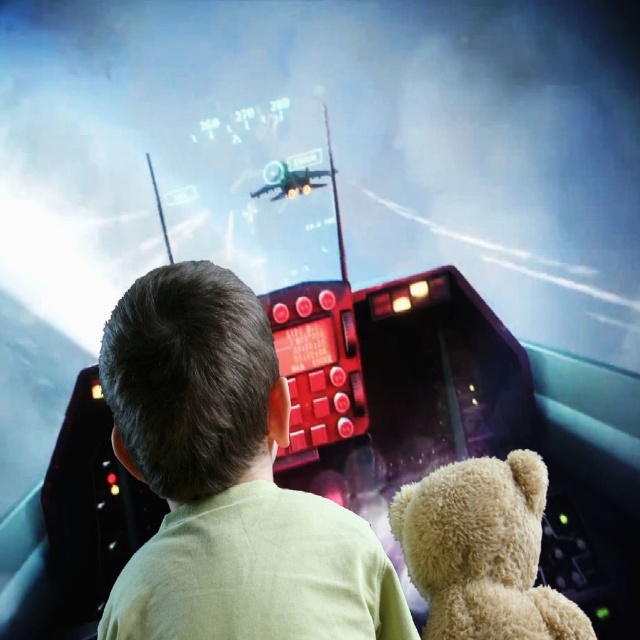
Is fuzzy beige teddy bear at center wider than shiny black plane at center?

Correct, the width of fuzzy beige teddy bear at center exceeds that of shiny black plane at center.

Between fuzzy beige teddy bear at center and shiny black plane at center, which one appears on the left side from the viewer's perspective?

shiny black plane at center

You are a GUI agent. You are given a task and a screenshot of the screen. Output one action in this format:
    pyautogui.click(x=<x>, y=<y>)
    Task: Click on the fuzzy beige teddy bear at center
    The image size is (640, 640).
    Given the screenshot: What is the action you would take?
    pyautogui.click(x=483, y=552)

Which is more to the left, shiny black helmet at center or fuzzy beige teddy bear at center?

From the viewer's perspective, shiny black helmet at center appears more on the left side.

Is the position of shiny black helmet at center more distant than that of fuzzy beige teddy bear at center?

No, it is not.

Does point (172, 285) come closer to viewer compared to point (525, 496)?

Yes, point (172, 285) is closer to viewer.

Identify the location of shiny black helmet at center. (227, 480).

Does shiny black helmet at center have a lesser height compared to shiny black plane at center?

No.

Between shiny black helmet at center and shiny black plane at center, which one appears on the right side from the viewer's perspective?

shiny black helmet at center is more to the right.

What do you see at coordinates (227, 480) in the screenshot?
I see `shiny black helmet at center` at bounding box center [227, 480].

Identify the location of shiny black helmet at center. (227, 480).